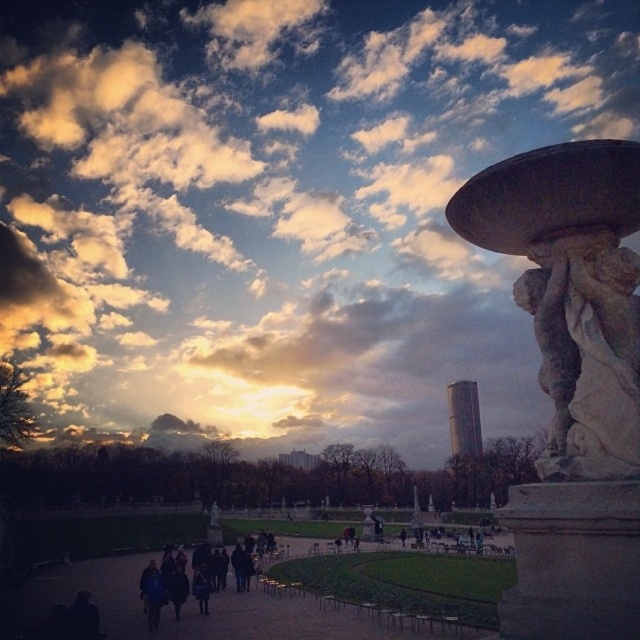
Is point (573, 301) positioned before point (465, 636)?

Yes, it is in front of point (465, 636).

Does white marble statue at right have a greater height compared to dark fabric path at lower left?

In fact, white marble statue at right may be shorter than dark fabric path at lower left.

Which is in front, point (556, 442) or point (234, 630)?

Point (556, 442)

Locate an element on the screen. white marble statue at right is located at coordinates (586, 353).

Who is shorter, cloudy sky at upper center or dark fabric path at lower left?

dark fabric path at lower left

Can you confirm if cloudy sky at upper center is shorter than dark fabric path at lower left?

In fact, cloudy sky at upper center may be taller than dark fabric path at lower left.

What do you see at coordinates (282, 205) in the screenshot?
I see `cloudy sky at upper center` at bounding box center [282, 205].

At what (x,y) coordinates should I click in order to perform the action: click on cloudy sky at upper center. Please return your answer as a coordinate pair (x, y). The width and height of the screenshot is (640, 640). Looking at the image, I should click on (282, 205).

Which is more to the left, dark fabric path at lower left or dark blue jacket at center?

dark blue jacket at center

From the picture: Does dark fabric path at lower left have a lesser width compared to dark blue jacket at center?

No, dark fabric path at lower left is not thinner than dark blue jacket at center.

This screenshot has width=640, height=640. What do you see at coordinates (196, 609) in the screenshot?
I see `dark fabric path at lower left` at bounding box center [196, 609].

Where is `dark fabric path at lower left`? dark fabric path at lower left is located at coordinates (196, 609).